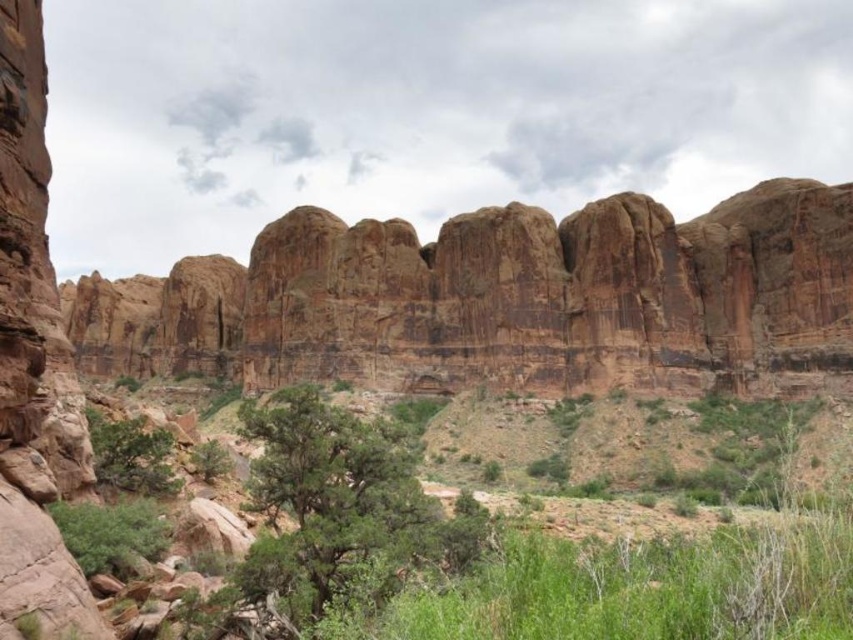
Question: Among these objects, which one is farthest from the camera?

Choices:
 (A) green leafy bush at lower left
 (B) rustic sandstone cliffs at center
 (C) green leafy shrubs at center
 (D) green leafy shrub at center

Answer: (B)

Question: Which point appears farthest from the camera in this image?

Choices:
 (A) (112, 524)
 (B) (770, 420)
 (C) (151, 435)
 (D) (515, 250)

Answer: (D)

Question: Is green leafy shrubs at center to the left of green leafy shrub at center from the viewer's perspective?

Choices:
 (A) yes
 (B) no

Answer: (B)

Question: Can you confirm if green leafy shrubs at center is thinner than green leafy bush at lower left?

Choices:
 (A) yes
 (B) no

Answer: (B)

Question: Which point appears farthest from the camera in this image?

Choices:
 (A) (641, 355)
 (B) (85, 518)
 (C) (733, 616)
 (D) (140, 474)

Answer: (A)

Question: Where is green leafy bush at lower left located in relation to green leafy shrub at center in the image?

Choices:
 (A) right
 (B) left

Answer: (A)